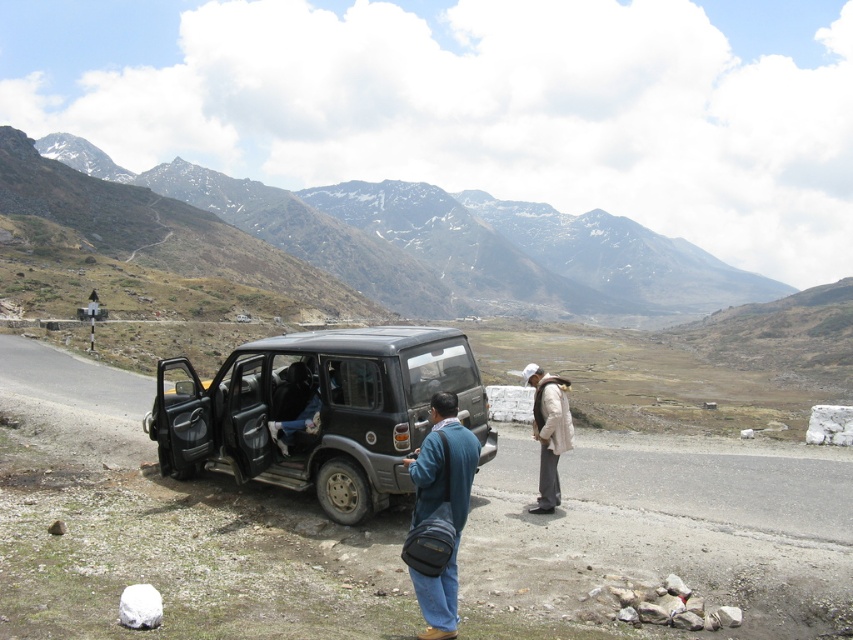
You are a photographer planning to take a portrait of the two people in the scene. You notice the white woolen jacket at center and the dark blue fabric pants at center. Which clothing item appears narrower in the photo?

The white woolen jacket at center appears narrower in the photo compared to the dark blue fabric pants at center because it has a lesser width according to the description.

In the scene shown: You are standing at the base of the snowy rocky mountain at upper center and want to reach the summit. Given that the average human walking speed is 3 miles per hour, how long would it take to hike to the summit if the trail is straight and the elevation gain is 1,500 feet?

The distance to the summit is 446.34 feet. Converting this to miles, it is approximately 0.0845 miles. At a walking speed of 3 mph, the time required would be roughly 0.0845 miles divided by 3 mph, which equals about 0.028 hours, or roughly 1.7 minutes. However, this calculation assumes a flat path and does not account for elevation gain or trail conditions, so actual time may vary significantly.